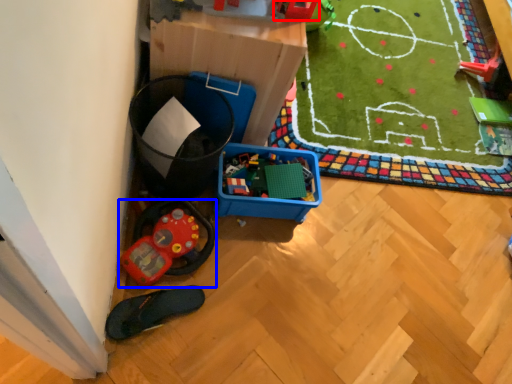
Question: Which object is closer to the camera taking this photo, toy (highlighted by a red box) or toy (highlighted by a blue box)?

Choices:
 (A) toy
 (B) toy

Answer: (A)